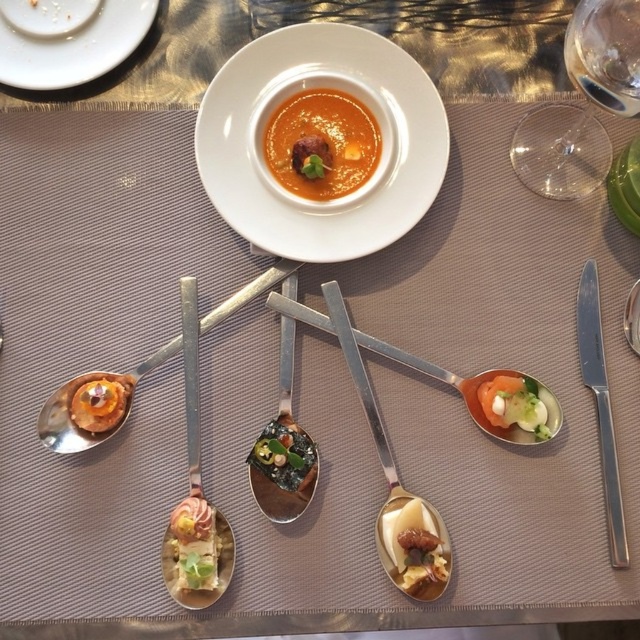
Looking at this image, can you confirm if shiny metallic spoon at center is positioned above green matte seaweed at center?

Indeed, shiny metallic spoon at center is positioned over green matte seaweed at center.

Consider the image. Is shiny metallic spoon at center positioned at the back of green matte seaweed at center?

That is True.

Is point (314, 488) positioned after point (264, 458)?

Yes.

The height and width of the screenshot is (640, 640). Identify the location of shiny metallic spoon at center. (284, 448).

From the picture: Is the position of white glossy plate at upper left less distant than that of green matte vegetable at upper center?

That is False.

Does point (35, 4) come behind point (506, 422)?

Yes, point (35, 4) is behind point (506, 422).

Image resolution: width=640 pixels, height=640 pixels. What do you see at coordinates (67, 38) in the screenshot?
I see `white glossy plate at upper left` at bounding box center [67, 38].

At what (x,y) coordinates should I click in order to perform the action: click on white glossy plate at upper left. Please return your answer as a coordinate pair (x, y). This screenshot has width=640, height=640. Looking at the image, I should click on (67, 38).

Is transparent glass at upper right closer to camera compared to smooth orange soup at center?

Yes, it is in front of smooth orange soup at center.

Looking at this image, between transparent glass at upper right and smooth orange soup at center, which one is positioned lower?

Positioned lower is smooth orange soup at center.

Does point (586, 35) lie in front of point (278, 180)?

That is True.

You are a GUI agent. You are given a task and a screenshot of the screen. Output one action in this format:
    pyautogui.click(x=<x>, y=<y>)
    Task: Click on the transparent glass at upper right
    
    Given the screenshot: What is the action you would take?
    pyautogui.click(x=582, y=106)